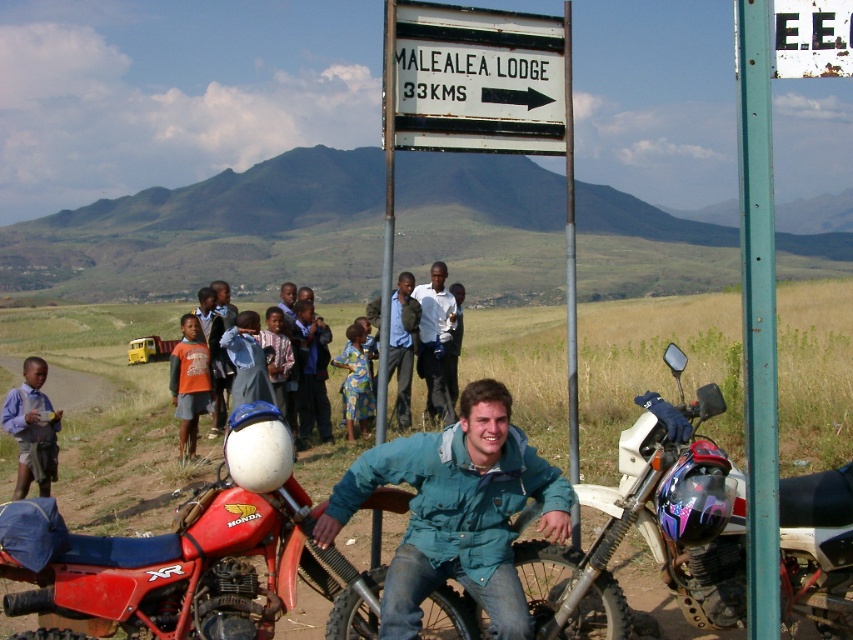
Question: From the image, what is the correct spatial relationship of teal fabric jacket at center in relation to light blue denim shorts at lower left?

Choices:
 (A) right
 (B) left

Answer: (A)

Question: Based on their relative distances, which object is nearer to the light blue denim shorts at lower left?

Choices:
 (A) orange cotton shirt at center
 (B) dark blue shirt at center
 (C) green painted metal pole at right

Answer: (A)

Question: Which point appears closest to the camera in this image?

Choices:
 (A) (184, 392)
 (B) (508, 36)
 (C) (361, 410)

Answer: (B)

Question: Which object appears farthest from the camera in this image?

Choices:
 (A) teal fabric jacket at center
 (B) printed fabric dress at center
 (C) red matte motorcycle at lower left

Answer: (B)

Question: Is the position of teal fabric jacket at center less distant than that of white plastic sign at center?

Choices:
 (A) yes
 (B) no

Answer: (A)

Question: Is red matte motorcycle at lower left positioned behind brown dirt track at lower left?

Choices:
 (A) no
 (B) yes

Answer: (A)